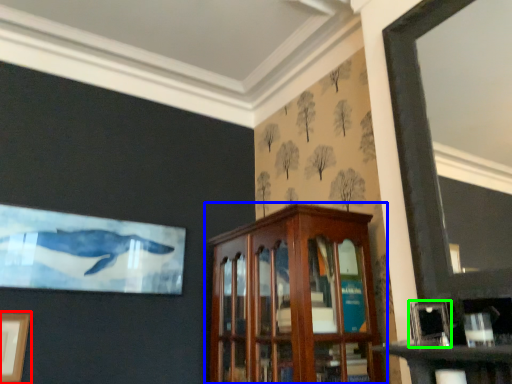
Question: Based on their relative distances, which object is farther from picture frame (highlighted by a red box)? Choose from cabinetry (highlighted by a blue box) and picture frame (highlighted by a green box).

Choices:
 (A) cabinetry
 (B) picture frame

Answer: (B)